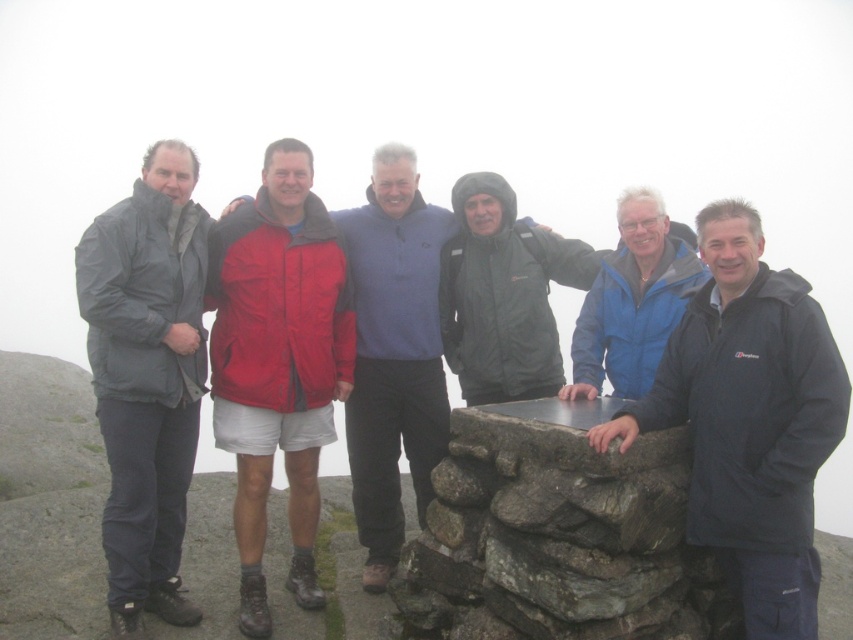
You are a photographer trying to capture the best shot of the two points in the scene. Which point, point (302, 540) or point (567, 280), would be more in focus if you focus on the closer one?

Point (302, 540) is closer to the camera than point (567, 280), so focusing on it would make it more in focus.

You are a photographer trying to capture a group photo of the men. You need to ensure that both the red fabric jacket at center and the red nylon jacket at center are clearly visible. Which jacket should you focus on to ensure the other is also in frame?

The red fabric jacket at center is bigger than the red nylon jacket at center, so focusing on the larger red fabric jacket at center will ensure the smaller red nylon jacket at center is also in frame.

You are a photographer trying to adjust the composition of this group photo. You want to ensure that the red fabric jacket at center and the matte black jacket at center are both visible in the frame. Which jacket should you focus on to make sure both are in focus, considering their sizes?

The red fabric jacket at center is much taller than the matte black jacket at center, so focusing on the taller red fabric jacket at center will ensure both are in focus.